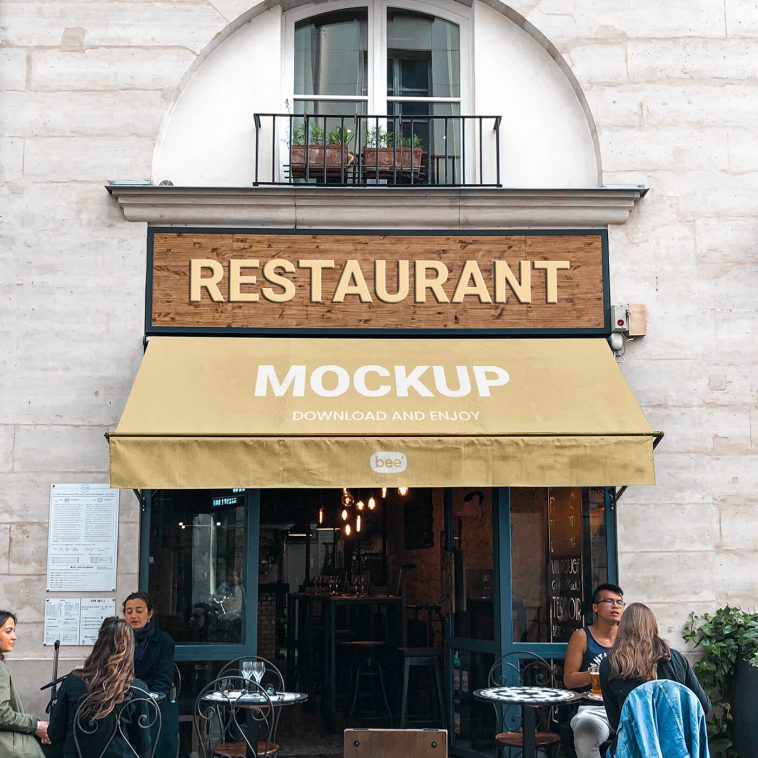
Identify the location of bar stools. 364,646, 412,662.